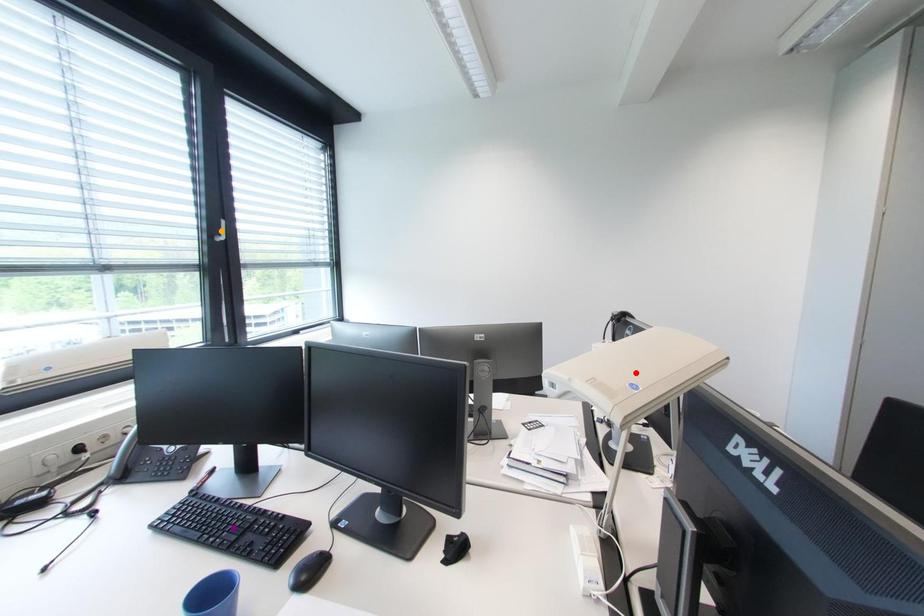
Order these from nearest to farthest:
orange point
red point
purple point

red point
purple point
orange point